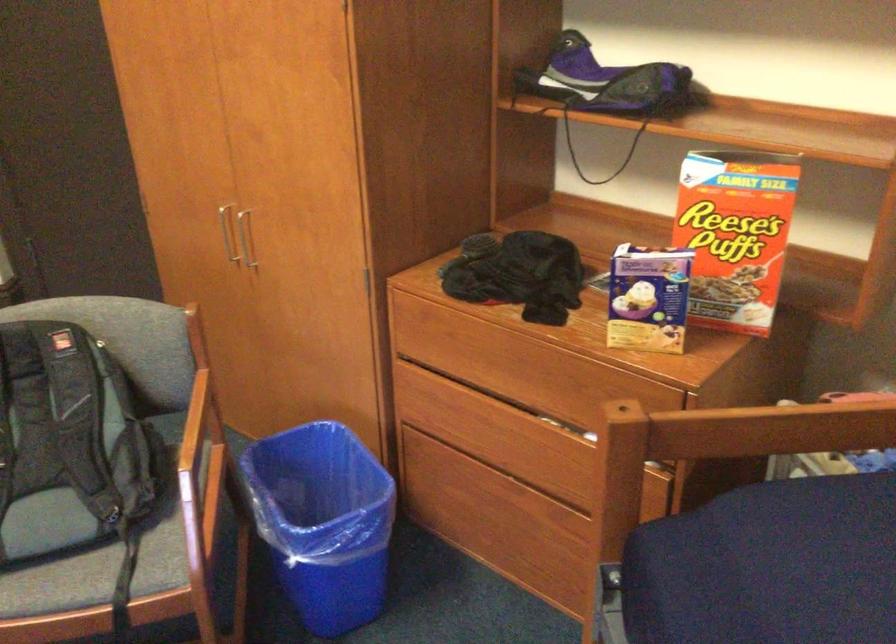
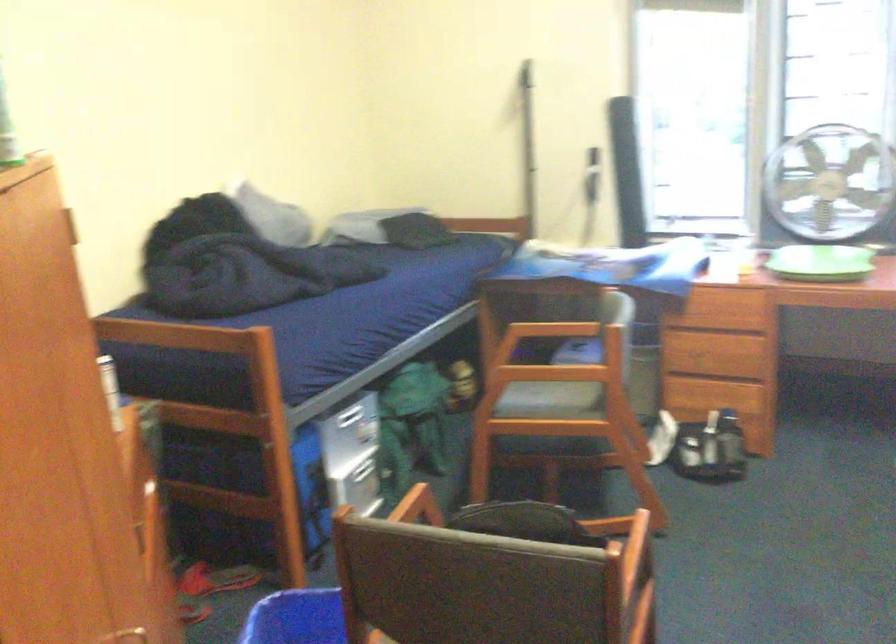
Question: I am providing you with two images of the same scene from different viewpoints. Please identify which objects are invisible in image2.

Choices:
 (A) silver drawer handle
 (B) gray chair seat
 (C) wooden chair armrest
 (D) none of these

Answer: (D)